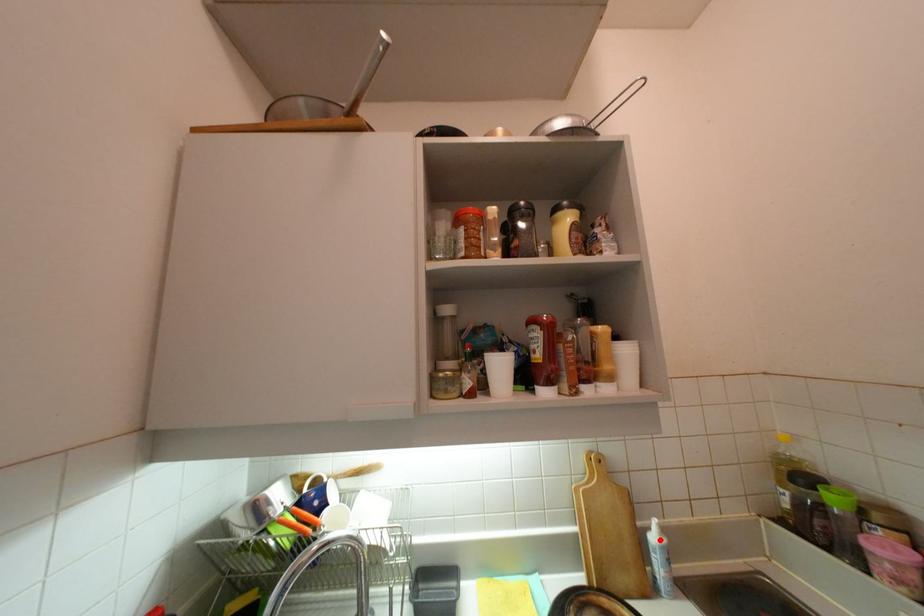
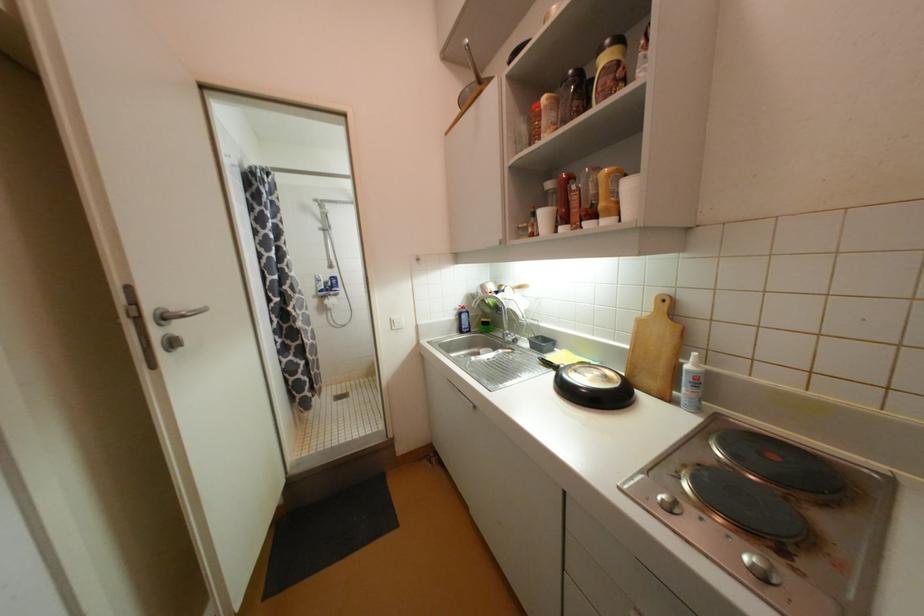
Find the pixel in the second image that matches the highlighted location in the first image.

(693, 368)